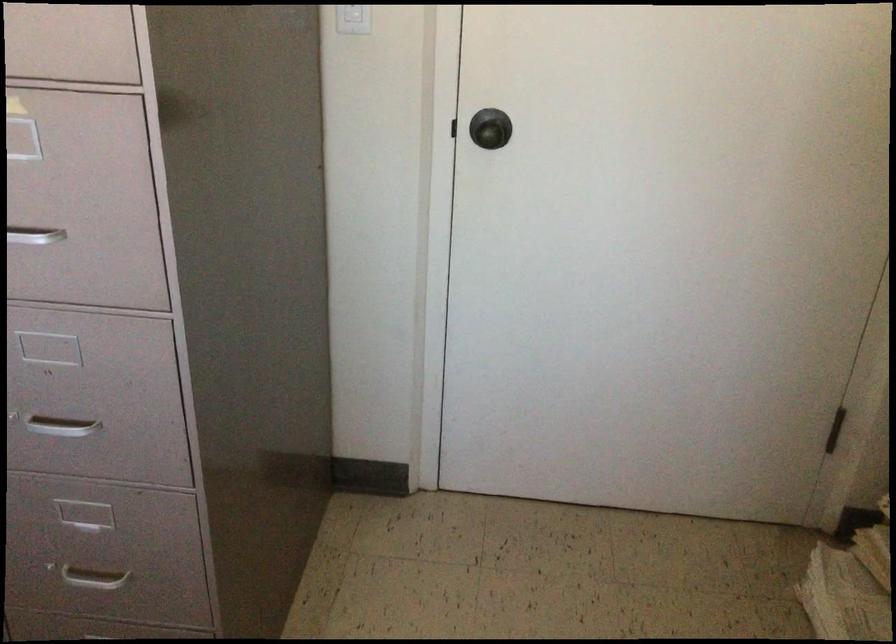
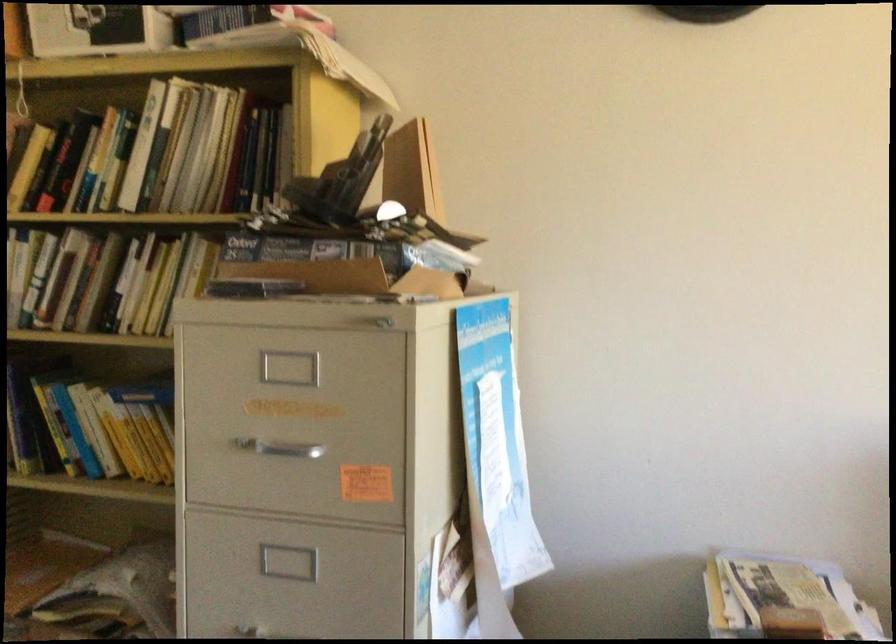
Question: The images are taken continuously from a first-person perspective. In which direction is your viewpoint rotating?

Choices:
 (A) Left
 (B) Right
 (C) Up
 (D) Down

Answer: (B)